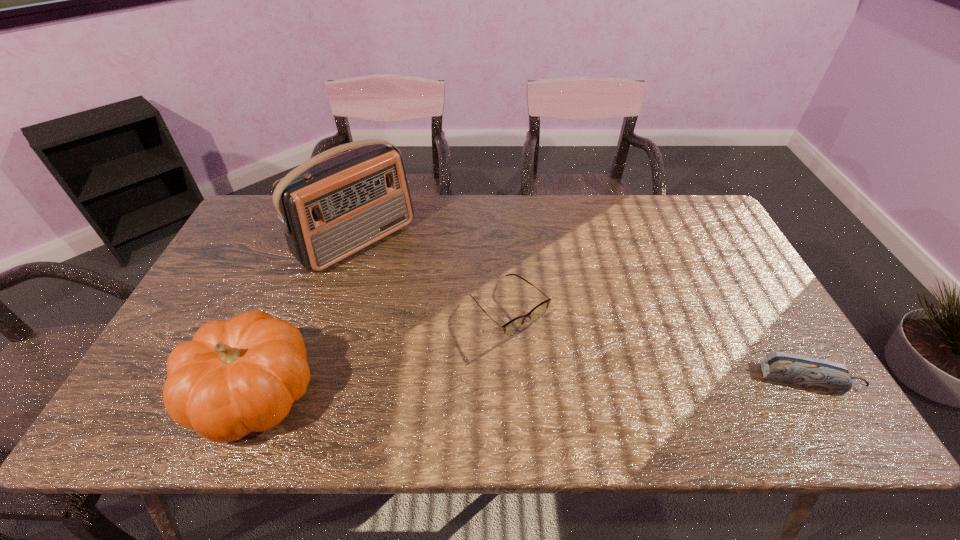
Where is `vacant spot on the desktop that is between the pumpkin and the rightmost object and is positioned on the front-facing side of the tallest object`? vacant spot on the desktop that is between the pumpkin and the rightmost object and is positioned on the front-facing side of the tallest object is located at coordinates (525, 386).

In order to click on vacant space on the desktop that is between the pumpkin and the pencil box and is positioned on the face of the spectacles in this screenshot , I will do `click(587, 384)`.